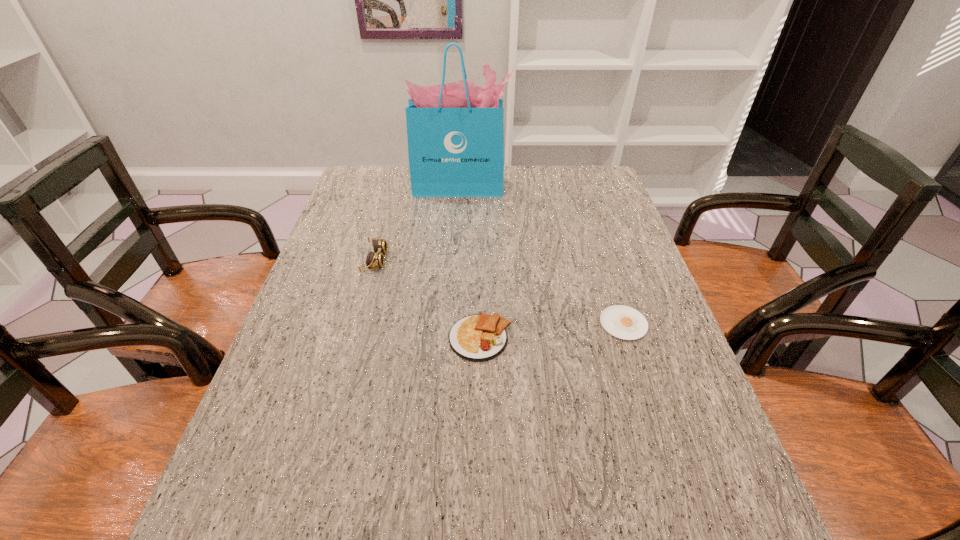
Find the location of a particular element. Image resolution: width=960 pixels, height=540 pixels. free space between the egg yolk and the second shortest object is located at coordinates (552, 331).

Image resolution: width=960 pixels, height=540 pixels. I want to click on free space between the third nearest object and the omelet, so [x=428, y=300].

This screenshot has width=960, height=540. Find the location of `vacant area that lies between the third shortest object and the farthest object`. vacant area that lies between the third shortest object and the farthest object is located at coordinates (419, 224).

The width and height of the screenshot is (960, 540). Find the location of `unoccupied position between the omelet and the second tallest object`. unoccupied position between the omelet and the second tallest object is located at coordinates (428, 300).

The image size is (960, 540). In order to click on vacant point located between the omelet and the third nearest object in this screenshot , I will do `click(428, 300)`.

The image size is (960, 540). What are the coordinates of `blank region between the leftmost object and the tallest object` in the screenshot? It's located at (419, 224).

This screenshot has height=540, width=960. I want to click on vacant area between the egg yolk and the third tallest object, so [552, 331].

The image size is (960, 540). Identify the location of vacant space that's between the leftmost object and the third tallest object. (428, 300).

Where is `free spot between the third tallest object and the leftmost object`? This screenshot has height=540, width=960. free spot between the third tallest object and the leftmost object is located at coordinates (428, 300).

Locate an element on the screen. This screenshot has height=540, width=960. free space that is in between the rightmost object and the second tallest object is located at coordinates (499, 292).